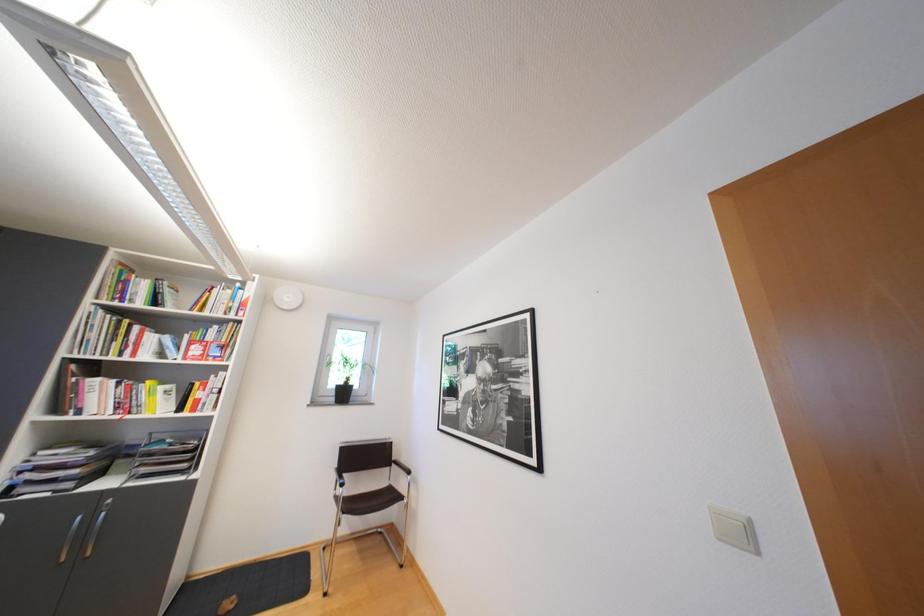
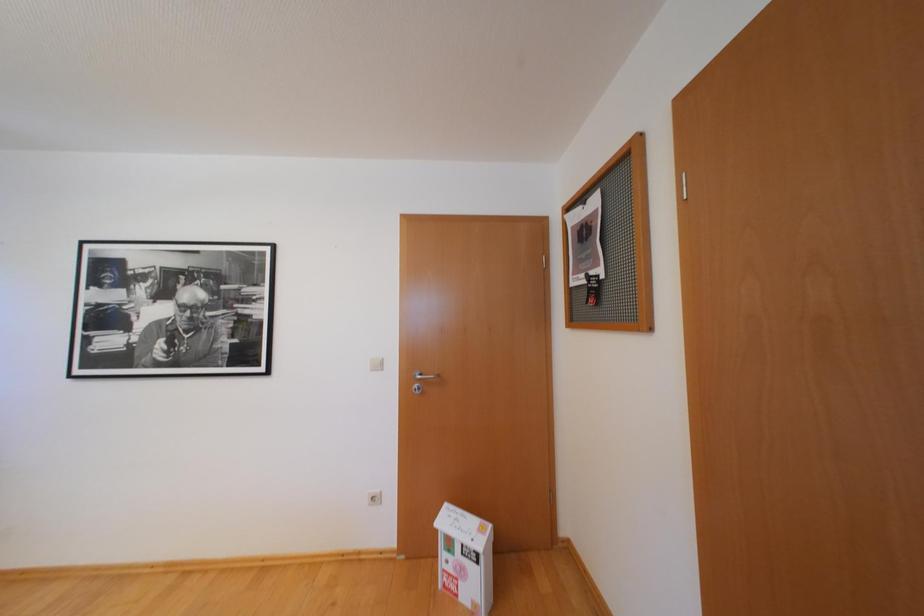
Question: Based on the continuous images, in which direction is the camera rotating? Reply with the corresponding letter.

Choices:
 (A) Left
 (B) Right
 (C) Up
 (D) Down

Answer: (B)